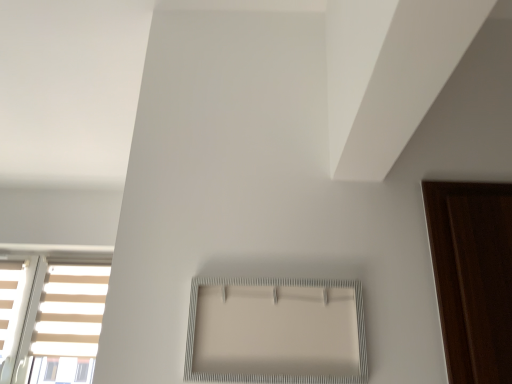
Question: Does point (380, 157) appear closer or farther from the camera than point (290, 337)?

Choices:
 (A) closer
 (B) farther

Answer: (B)

Question: Considering the relative positions of white matte blind at upper right and white textured frame at center, which is counted as the second window, starting from the bottom, in the image provided, is white matte blind at upper right to the left or to the right of white textured frame at center, which is counted as the second window, starting from the bottom,?

Choices:
 (A) right
 (B) left

Answer: (A)

Question: Estimate the real-world distances between objects in this image. Which object is closer to the white striped window at lower left, which is the 2th window from right to left?

Choices:
 (A) white matte blind at upper right
 (B) white textured frame at center, which ranks as the first window in right-to-left order

Answer: (B)

Question: Based on their relative distances, which object is nearer to the white matte blind at upper right?

Choices:
 (A) white striped window at lower left, the 2th window viewed from the front
 (B) white textured frame at center, which is counted as the second window, starting from the bottom

Answer: (B)